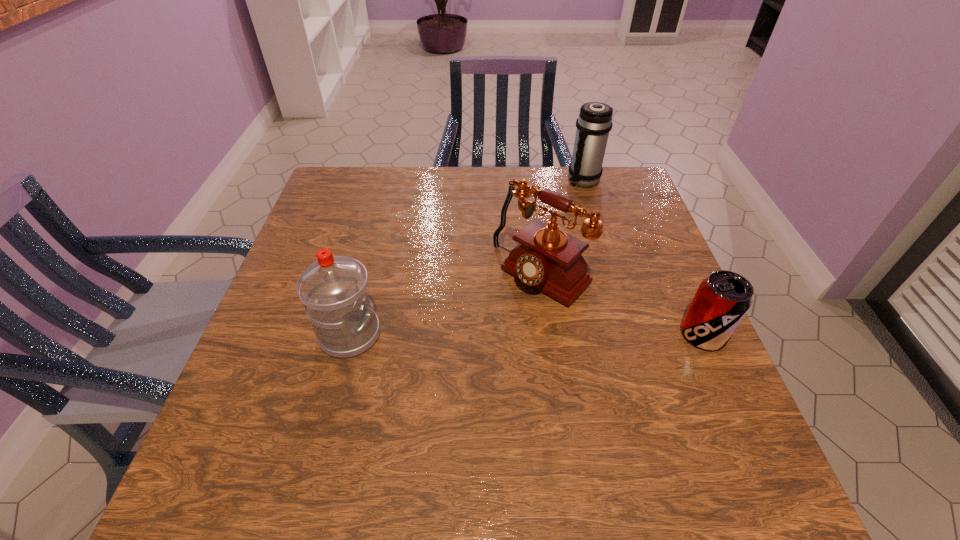
Identify the location of vacant space that satisfies the following two spatial constraints: 1. on the back side of the second farthest object; 2. on the left side of the thermos bottle. (528, 180).